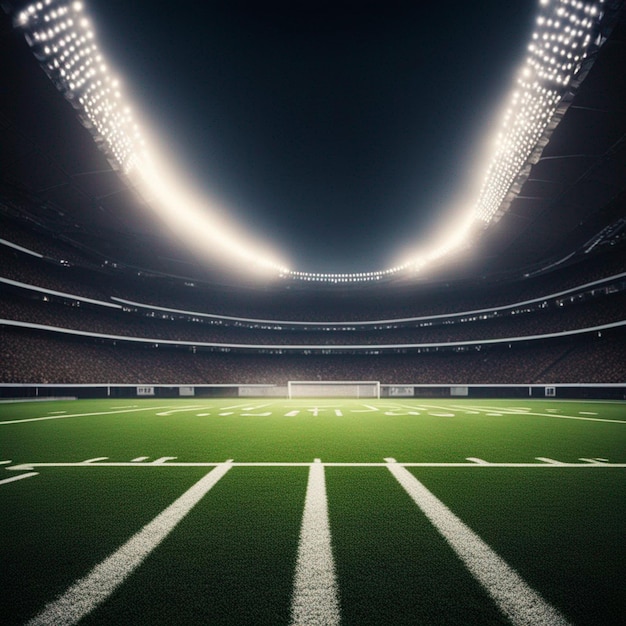
The width and height of the screenshot is (626, 626). I want to click on stairs, so click(571, 252), click(541, 367).